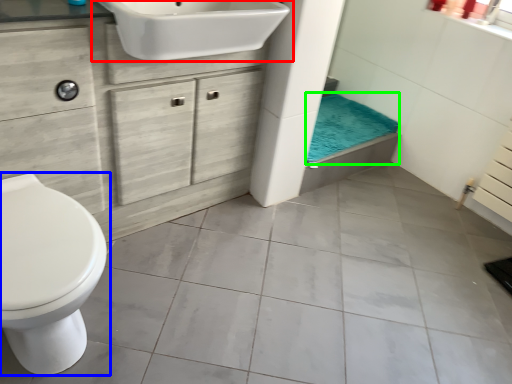
Question: Considering the real-world distances, which object is farthest from sink (highlighted by a red box)? toilet (highlighted by a blue box) or bath towel (highlighted by a green box)?

Choices:
 (A) toilet
 (B) bath towel

Answer: (B)